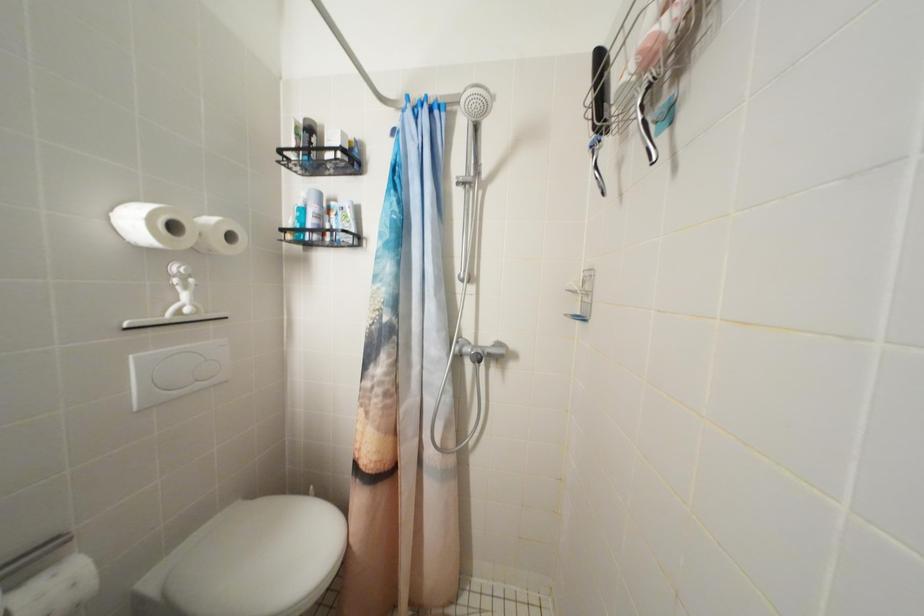
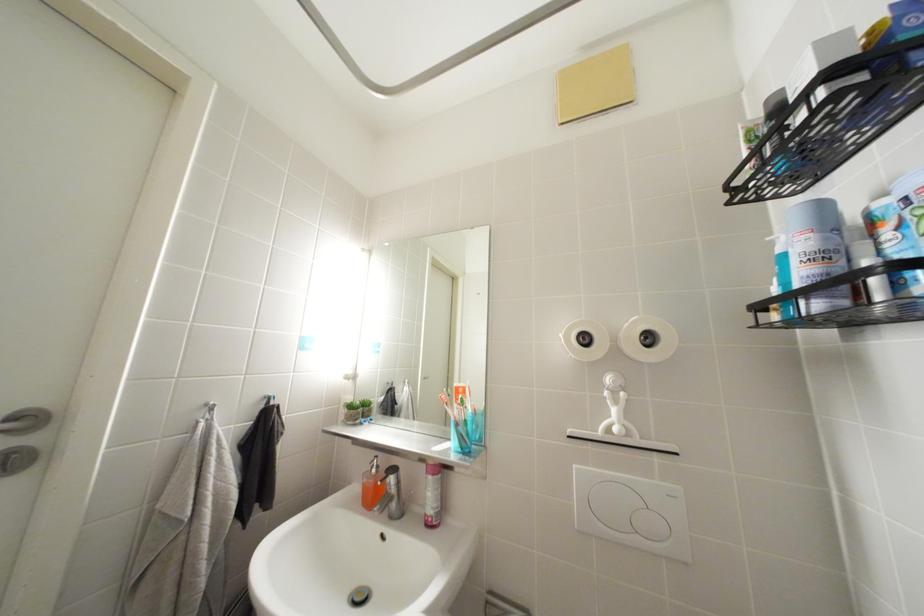
Question: Based on the continuous images, in which direction is the camera rotating? Reply with the corresponding letter.

Choices:
 (A) Left
 (B) Right
 (C) Up
 (D) Down

Answer: (A)